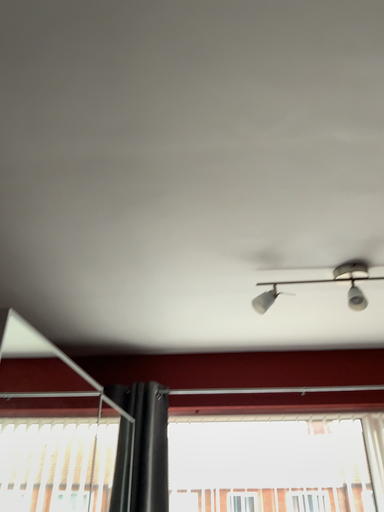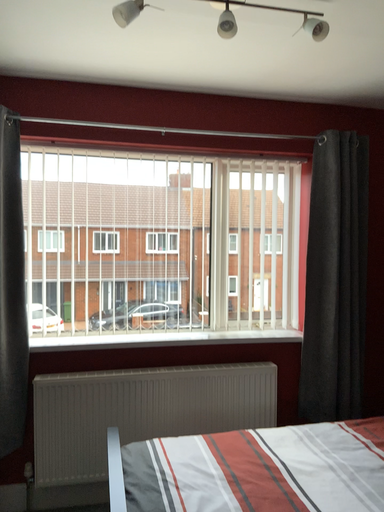
Question: Which way did the camera rotate in the video?

Choices:
 (A) rotated downward
 (B) rotated upward

Answer: (A)